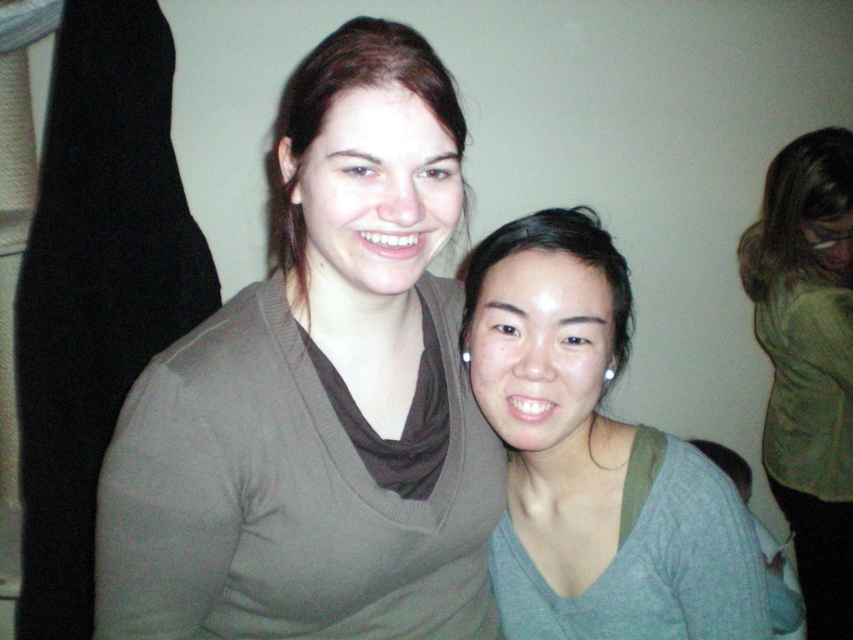
Question: Which object appears farthest from the camera in this image?

Choices:
 (A) gray matte sweater at center
 (B) green velvet sweater at upper right
 (C) matte brown hair at upper center
 (D) matte brown sweater at upper left

Answer: (B)

Question: Among these points, which one is farthest from the camera?

Choices:
 (A) (776, 422)
 (B) (312, 593)

Answer: (A)

Question: Does matte brown sweater at upper left appear over matte brown hair at upper center?

Choices:
 (A) no
 (B) yes

Answer: (A)

Question: Which object is positioned closest to the gray matte sweater at center?

Choices:
 (A) matte brown sweater at upper left
 (B) matte brown hair at upper center

Answer: (A)

Question: Can you confirm if green velvet sweater at upper right is positioned to the left of matte brown hair at upper center?

Choices:
 (A) yes
 (B) no

Answer: (B)

Question: Can you confirm if gray matte sweater at center is wider than green velvet sweater at upper right?

Choices:
 (A) yes
 (B) no

Answer: (A)